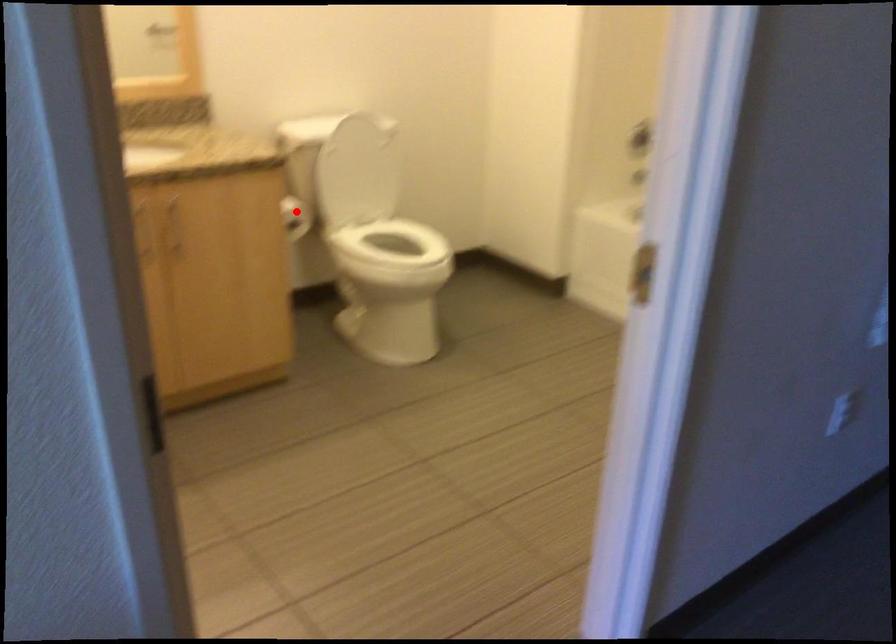
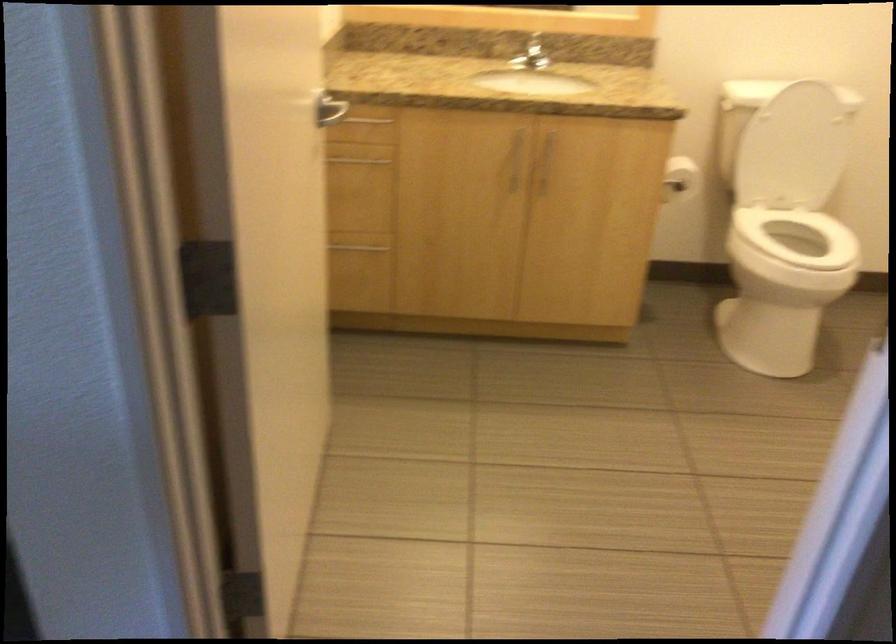
Locate, in the second image, the point that corresponds to the highlighted location in the first image.

(679, 178)